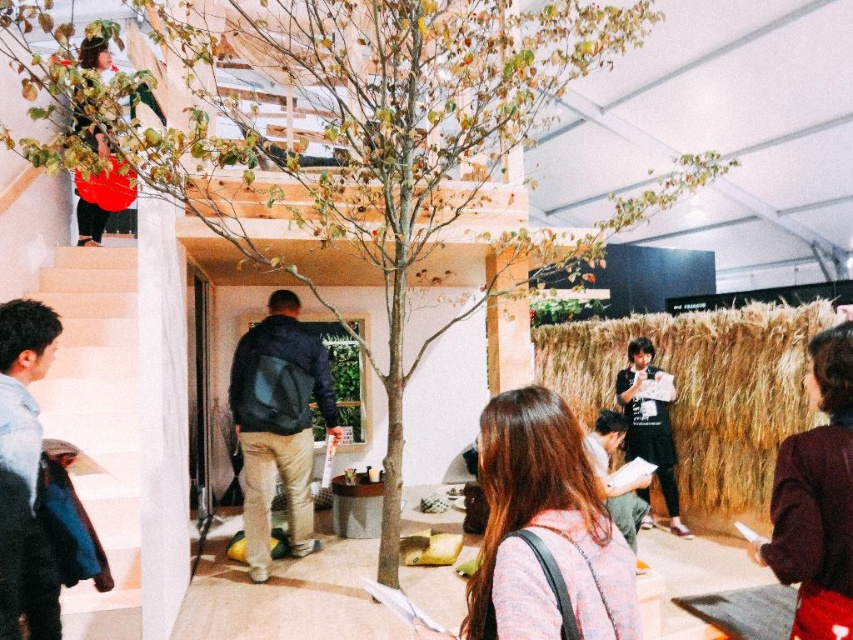
The image size is (853, 640). In order to click on blue denim jacket at lower left in this screenshot , I will do `click(22, 384)`.

Is blue denim jacket at lower left thinner than matte red dress at upper left?

Yes.

Is point (44, 620) positioned after point (97, 230)?

No, it is not.

Locate an element on the screen. The image size is (853, 640). blue denim jacket at lower left is located at coordinates (22, 384).

Does maroon fabric coat at lower right appear under black cotton shirt at center?

No, maroon fabric coat at lower right is not below black cotton shirt at center.

Does maroon fabric coat at lower right have a lesser height compared to black cotton shirt at center?

Correct, maroon fabric coat at lower right is not as tall as black cotton shirt at center.

Find the location of a particular element. This screenshot has width=853, height=640. maroon fabric coat at lower right is located at coordinates (817, 499).

Looking at this image, does white matte stairs at lower left appear under black leather jacket at center?

Actually, white matte stairs at lower left is above black leather jacket at center.

Where is `white matte stairs at lower left`? white matte stairs at lower left is located at coordinates tap(97, 419).